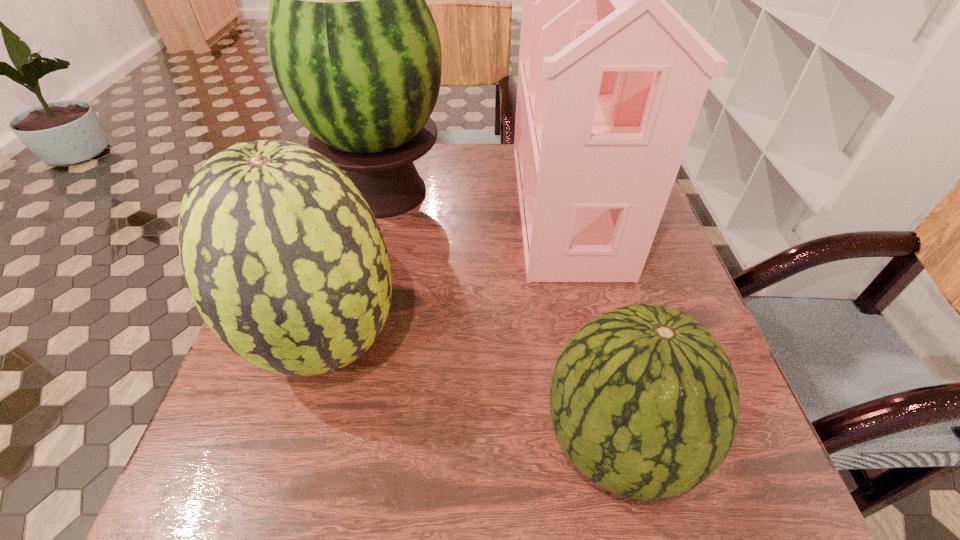
What are the coordinates of `the third closest object to the dollhouse` in the screenshot? It's located at (283, 257).

At what (x,y) coordinates should I click in order to perform the action: click on the third closest watermelon to the dollhouse. Please return your answer as a coordinate pair (x, y). The image size is (960, 540). Looking at the image, I should click on (283, 257).

Locate which watermelon is the second closest to the tallest watermelon. Please provide its 2D coordinates. Your answer should be formatted as a tuple, i.e. [(x, y)], where the tuple contains the x and y coordinates of a point satisfying the conditions above.

[(644, 401)]

This screenshot has height=540, width=960. In order to click on free space in the image that satisfies the following two spatial constraints: 1. on the front side of the farthest watermelon; 2. on the right side of the shortest object in this screenshot , I will do `click(320, 442)`.

Image resolution: width=960 pixels, height=540 pixels. Identify the location of blank space that satisfies the following two spatial constraints: 1. on the front-facing side of the dollhouse; 2. on the front side of the second shortest object. (596, 341).